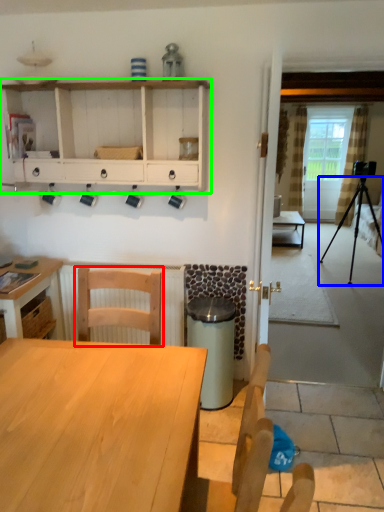
Question: Based on their relative distances, which object is nearer to chair (highlighted by a red box)? Choose from tripod (highlighted by a blue box) and shelf (highlighted by a green box).

Choices:
 (A) tripod
 (B) shelf

Answer: (B)